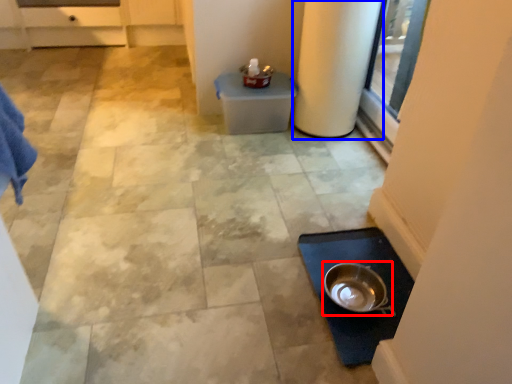
Question: Which point is further to the camera, mixing bowl (highlighted by a red box) or pillar (highlighted by a blue box)?

Choices:
 (A) mixing bowl
 (B) pillar

Answer: (B)